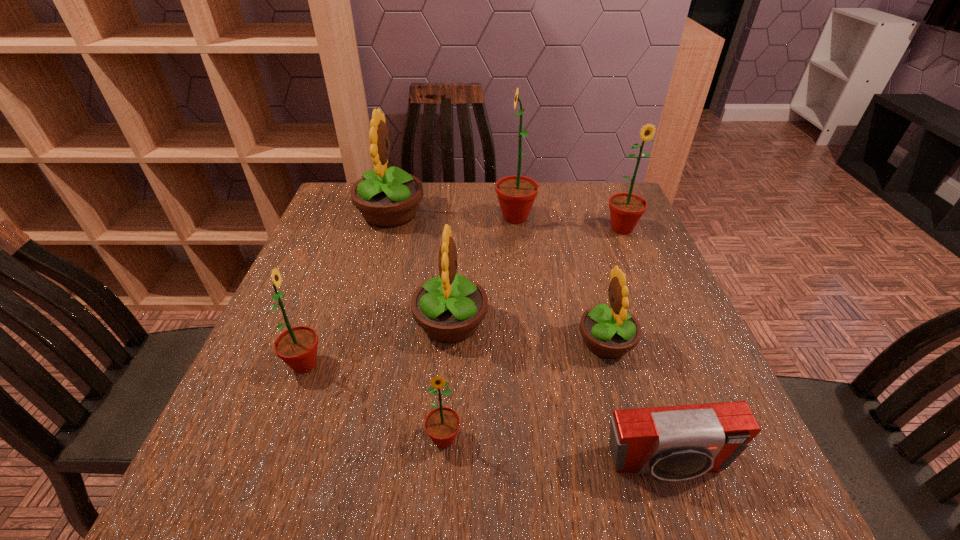
Where is `vacant area that lies between the second sunflower from right to left and the shortest object`? The width and height of the screenshot is (960, 540). vacant area that lies between the second sunflower from right to left and the shortest object is located at coordinates [636, 403].

The width and height of the screenshot is (960, 540). I want to click on empty space that is in between the second smallest green sunflower and the second yellow sunflower from right to left, so click(377, 343).

Locate an element on the screen. Image resolution: width=960 pixels, height=540 pixels. blank region between the rightmost sunflower and the second green sunflower from left to right is located at coordinates (533, 334).

Locate an element on the screen. vacant area between the third smallest green sunflower and the second smallest yellow sunflower is located at coordinates (537, 276).

Locate an element on the screen. object that can be found as the fifth closest to the biggest green sunflower is located at coordinates (297, 347).

Select which object is the closest to the smallest green sunflower. Please provide its 2D coordinates. Your answer should be formatted as a tuple, i.e. [(x, y)], where the tuple contains the x and y coordinates of a point satisfying the conditions above.

[(449, 307)]

Choose which sunflower is the fifth nearest neighbor to the third biggest green sunflower. Please provide its 2D coordinates. Your answer should be formatted as a tuple, i.e. [(x, y)], where the tuple contains the x and y coordinates of a point satisfying the conditions above.

[(516, 194)]

Identify which sunflower is located as the fifth nearest to the rightmost green sunflower. Please provide its 2D coordinates. Your answer should be formatted as a tuple, i.e. [(x, y)], where the tuple contains the x and y coordinates of a point satisfying the conditions above.

[(442, 424)]

The height and width of the screenshot is (540, 960). In order to click on green sunflower that is the closest one to the tallest object in this screenshot , I will do `click(626, 209)`.

Identify which green sunflower is the second closest to the third farthest green sunflower. Please provide its 2D coordinates. Your answer should be formatted as a tuple, i.e. [(x, y)], where the tuple contains the x and y coordinates of a point satisfying the conditions above.

[(516, 194)]